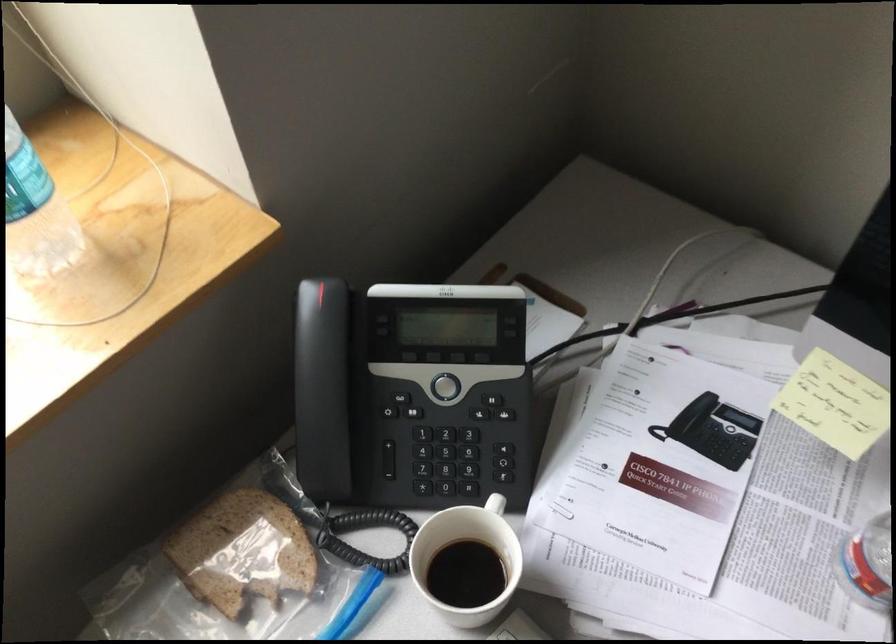
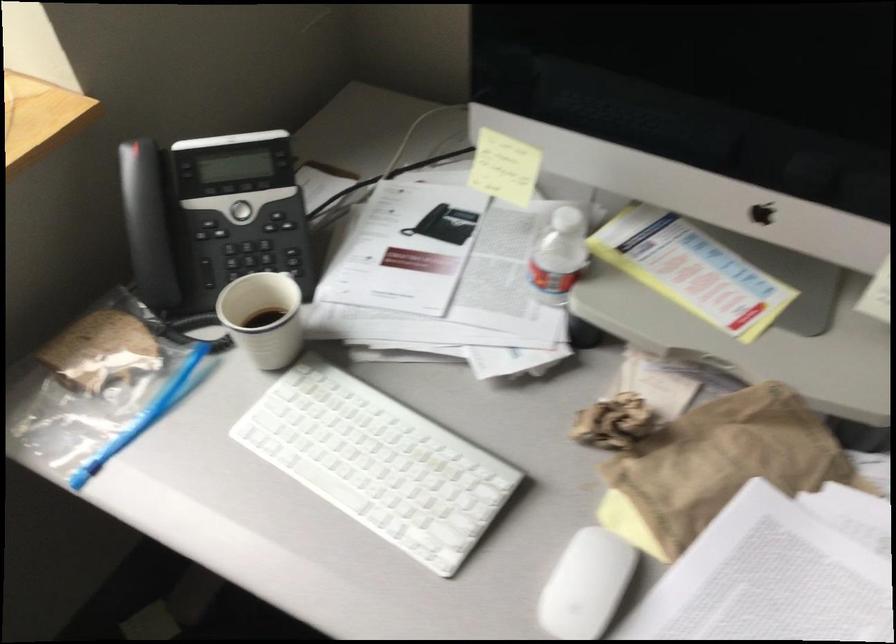
Question: The images are taken continuously from a first-person perspective. In which direction is your viewpoint rotating?

Choices:
 (A) Left
 (B) Right
 (C) Up
 (D) Down

Answer: (C)